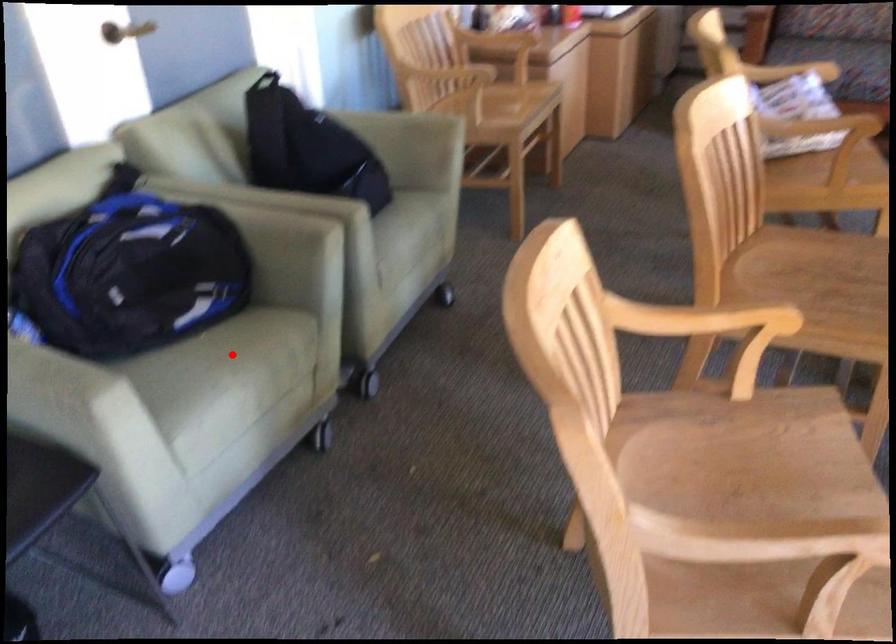
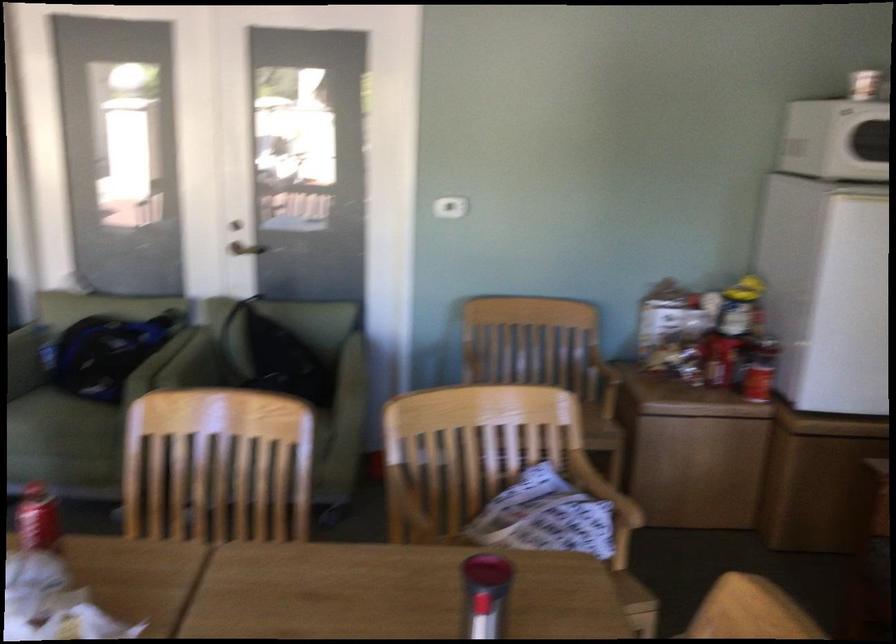
Question: I am providing you with two images of the same scene from different viewpoints. In image1, a red point is highlighted. Considering the same 3D point in image2, which of the following is correct?

Choices:
 (A) It is closer
 (B) It is farther

Answer: (B)